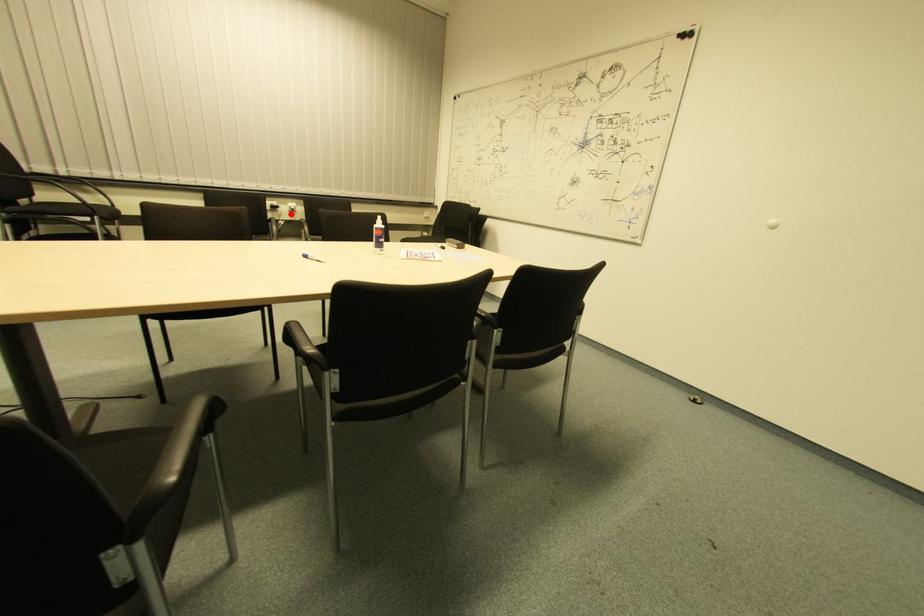
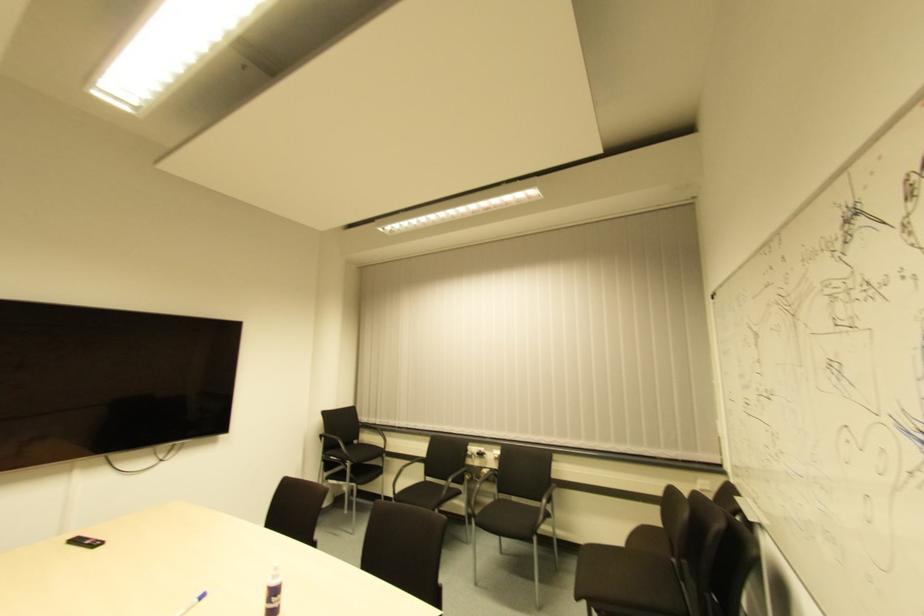
In the second image, find the point that corresponds to the highlighted location in the first image.

(494, 462)